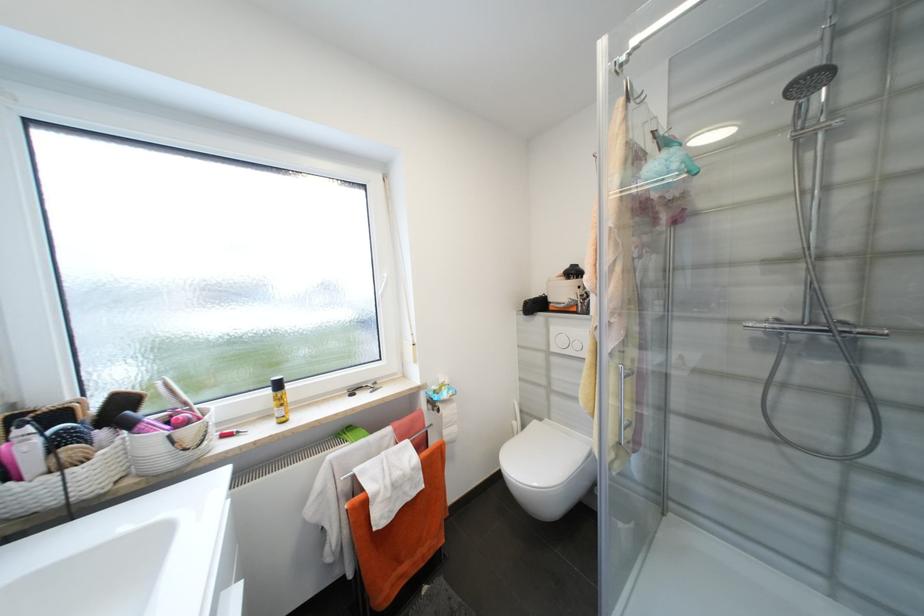
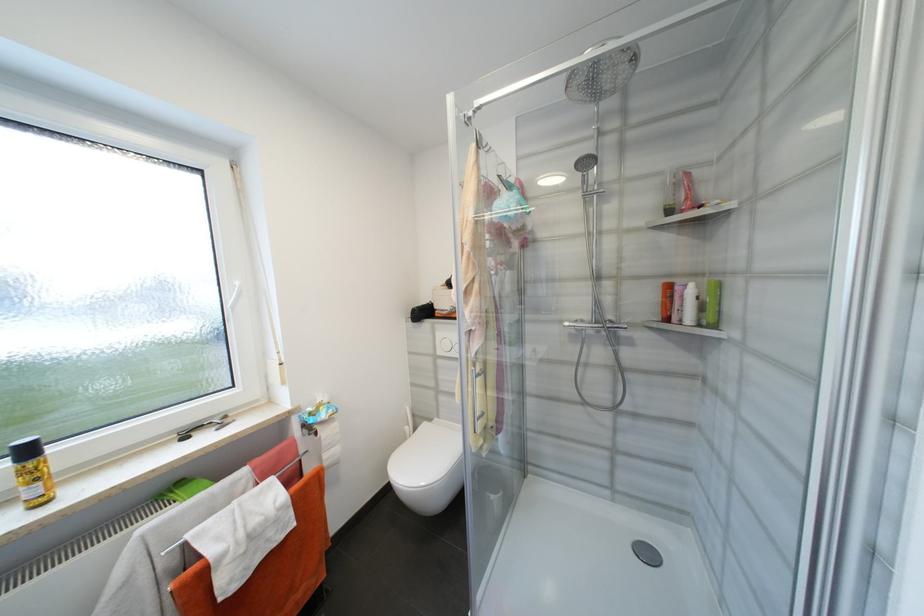
Find the pixel in the second image that matches [380,387] in the first image.

(228, 422)